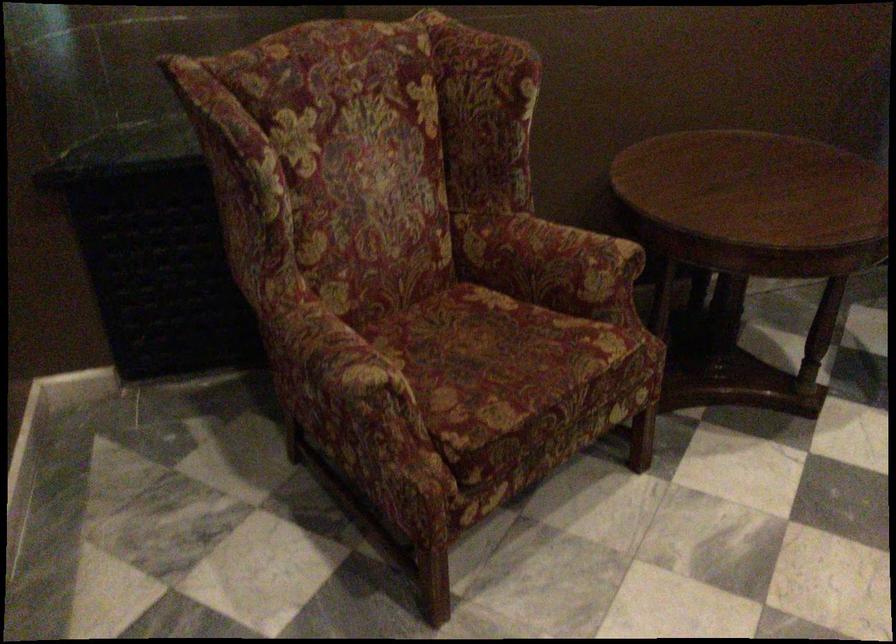
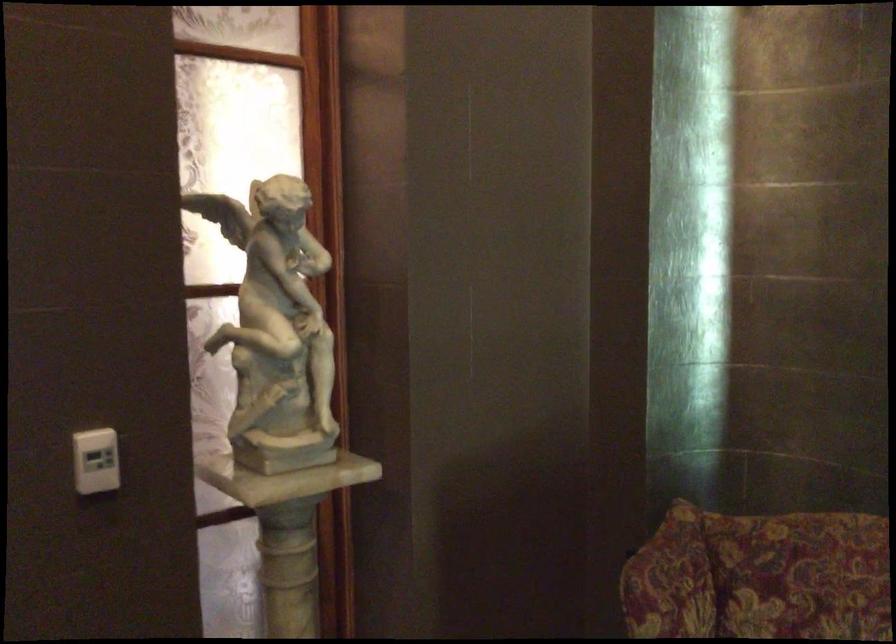
Find the pixel in the second image that matches pixel 236 113 in the first image.

(670, 581)